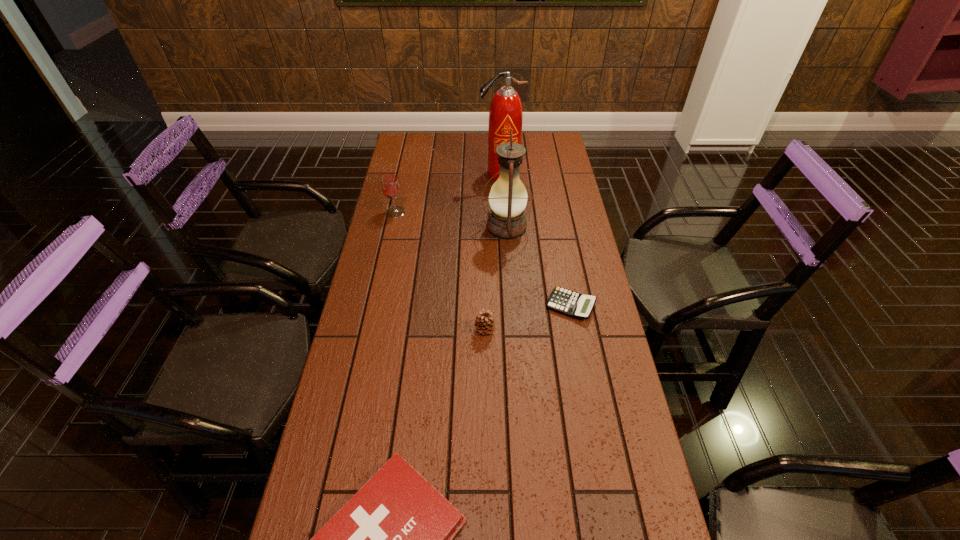
Locate an element on the screen. The width and height of the screenshot is (960, 540). the farthest object is located at coordinates (506, 114).

The image size is (960, 540). I want to click on oil lamp, so click(508, 197).

The height and width of the screenshot is (540, 960). I want to click on wineglass, so click(x=390, y=184).

This screenshot has width=960, height=540. In order to click on pinecone in this screenshot , I will do `click(484, 323)`.

This screenshot has width=960, height=540. Identify the location of calculator. (573, 304).

Identify the location of the shortest object. This screenshot has width=960, height=540. (573, 304).

Where is `free location located on the left of the farthest object`? The width and height of the screenshot is (960, 540). free location located on the left of the farthest object is located at coordinates (464, 173).

The height and width of the screenshot is (540, 960). Identify the location of free region located 0.100m on the right of the oil lamp. (558, 227).

This screenshot has width=960, height=540. In order to click on vacant space situated on the back of the wineglass in this screenshot , I will do `click(408, 156)`.

The image size is (960, 540). What are the coordinates of `free spot located on the right of the pinecone` in the screenshot? It's located at (593, 330).